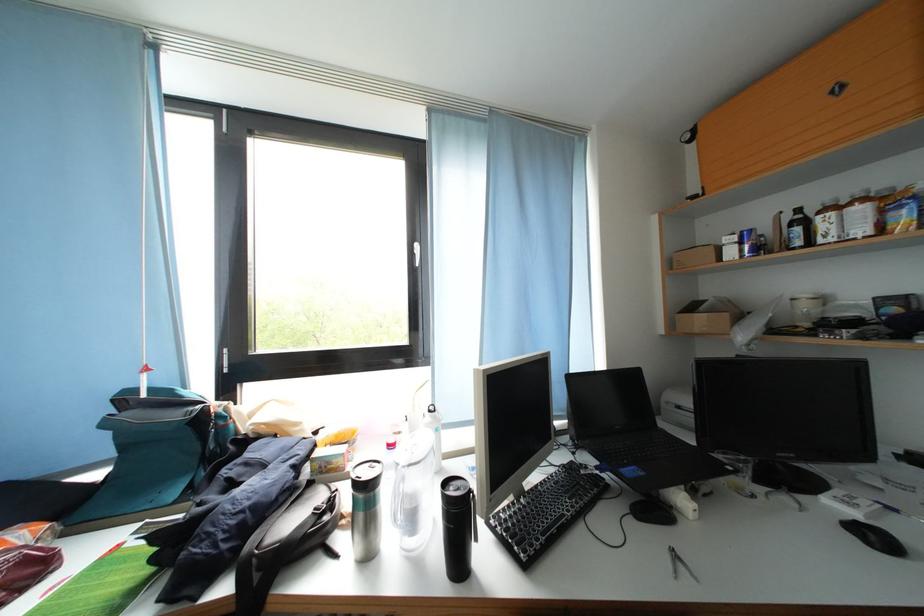
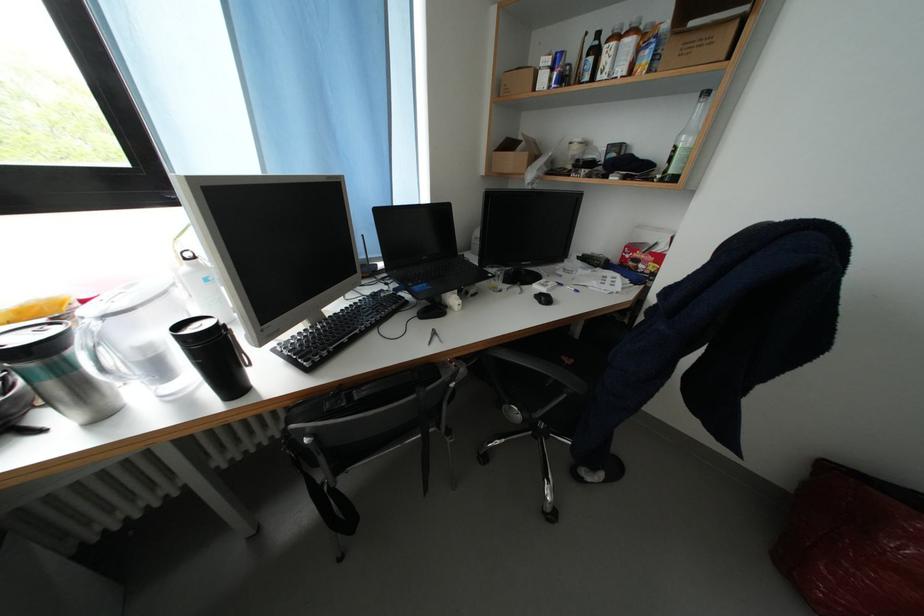
The images are taken continuously from a first-person perspective. In which direction is your viewpoint rotating?

The camera's rotation is toward right-down.